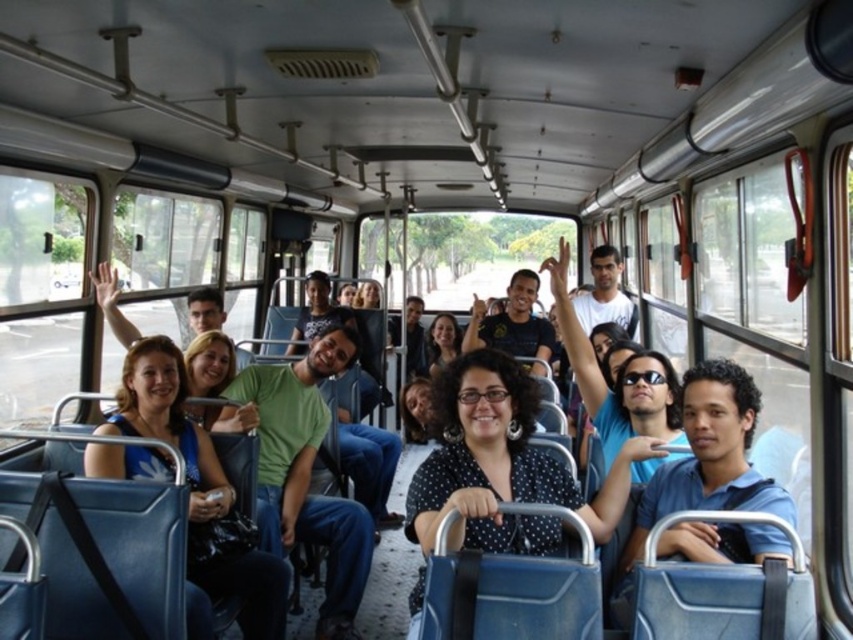
Question: Which object is closer to the camera taking this photo?

Choices:
 (A) blue cotton shirt at center
 (B) black dotted blouse at center
 (C) matte blue shirt at center

Answer: (B)

Question: Which point appears farthest from the camera in this image?

Choices:
 (A) (294, 426)
 (B) (628, 540)
 (C) (131, 476)
 (D) (486, 502)

Answer: (A)

Question: Can you confirm if green matte shirt at center is smaller than blue cotton shirt at center?

Choices:
 (A) no
 (B) yes

Answer: (A)

Question: Which of the following is the farthest from the observer?

Choices:
 (A) (698, 500)
 (B) (213, 506)
 (C) (469, 541)

Answer: (B)

Question: Is black dotted blouse at center bigger than blue cotton shirt at center?

Choices:
 (A) no
 (B) yes

Answer: (B)

Question: Is black dotted blouse at center wider than blue cotton shirt at center?

Choices:
 (A) no
 (B) yes

Answer: (B)